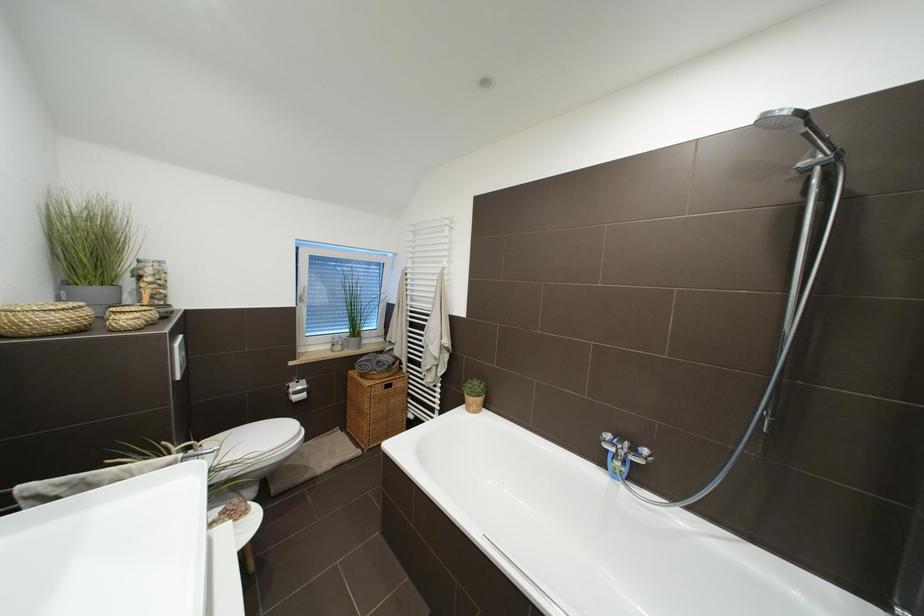
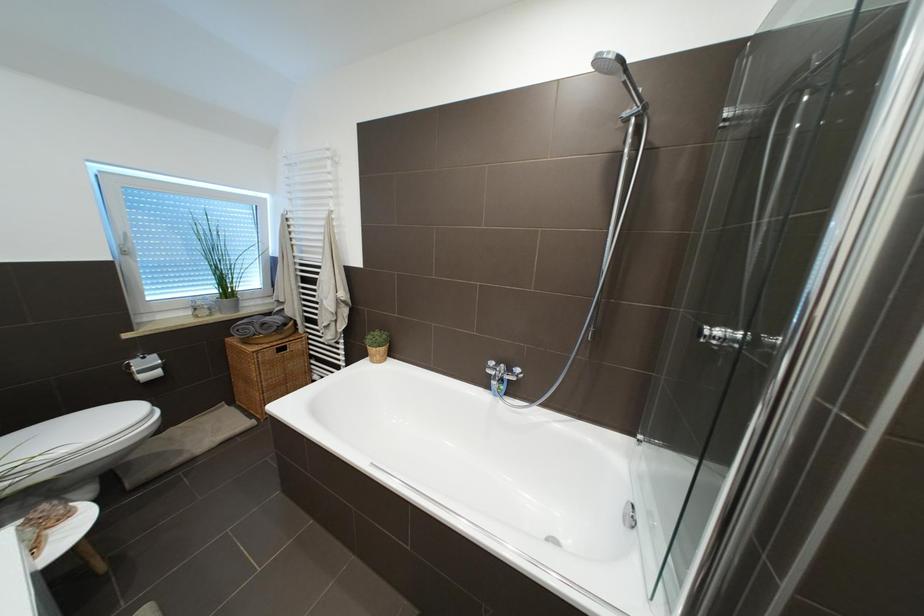
Question: The camera is either moving clockwise (left) or counter-clockwise (right) around the object. The first image is from the beginning of the video and the second image is from the end. Is the camera moving left or right when shooting the video?

Choices:
 (A) Left
 (B) Right

Answer: (A)